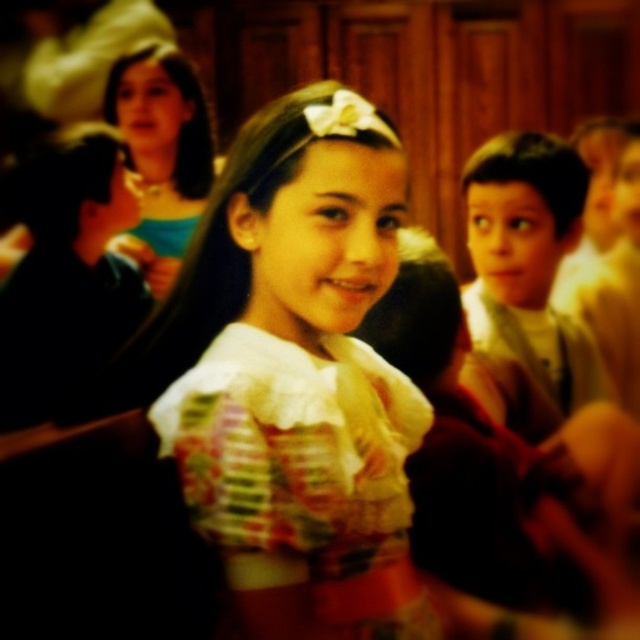
Is point (509, 445) farther from camera compared to point (506, 400)?

No.

Does matte floral dress at center have a smaller size compared to light brown hair at right?

No.

In the scene shown: Measure the distance between point (426, 472) and camera.

Point (426, 472) and camera are 3.89 feet apart.

Locate an element on the screen. The image size is (640, 640). matte floral dress at center is located at coordinates (460, 444).

Does point (362, 100) come closer to viewer compared to point (525, 296)?

That is True.

Does white lace dress at center have a larger size compared to light brown hair at right?

No.

Between point (340, 572) and point (484, 320), which one is positioned behind?

The point (484, 320) is behind.

Locate an element on the screen. white lace dress at center is located at coordinates (301, 378).

Based on the photo, measure the distance between white lace dress at center and camera.

white lace dress at center is 29.97 inches away from camera.

Does point (259, 445) come behind point (448, 417)?

That is False.

This screenshot has height=640, width=640. Find the location of `white lace dress at center`. white lace dress at center is located at coordinates (301, 378).

The height and width of the screenshot is (640, 640). What are the coordinates of `white lace dress at center` in the screenshot? It's located at (301, 378).